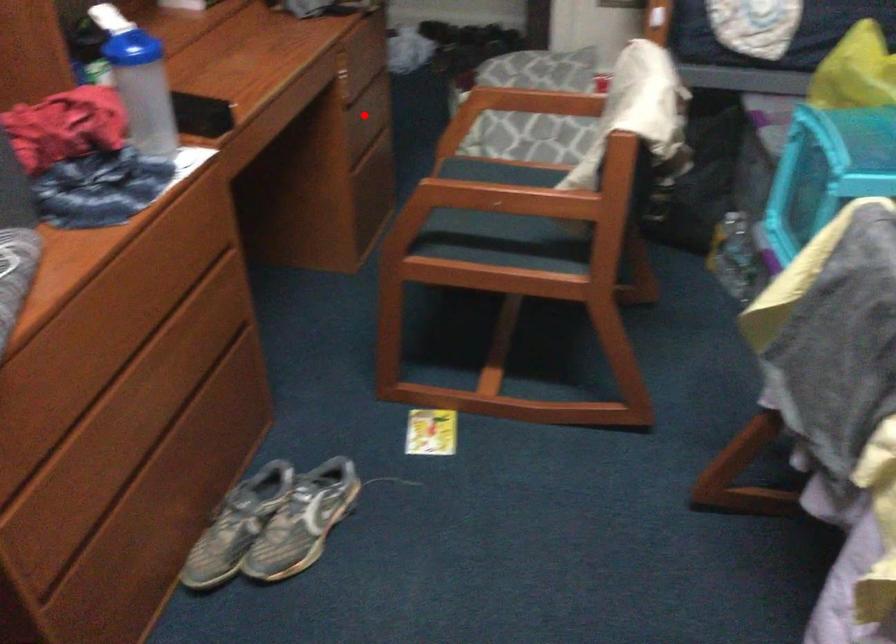
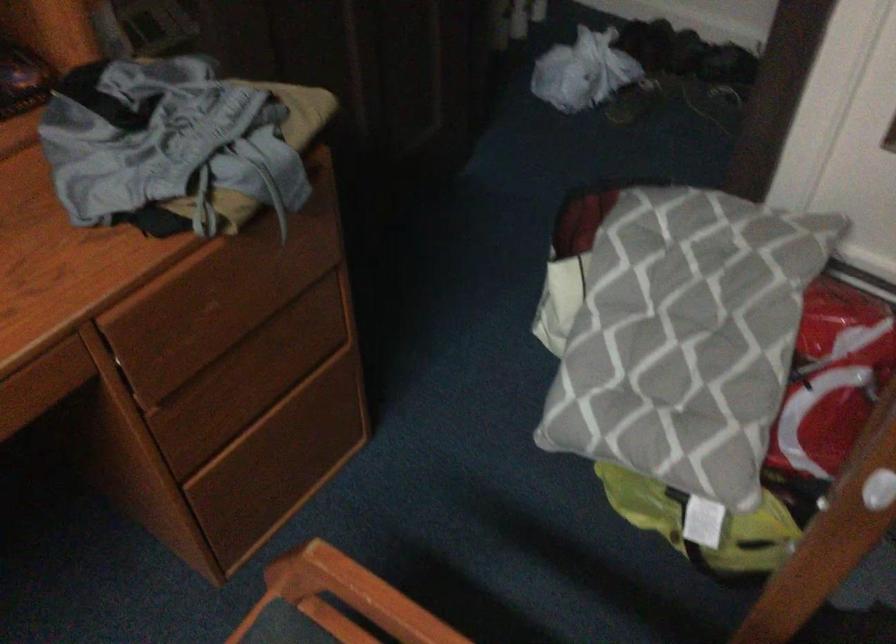
Locate, in the second image, the point that corresponds to the highlighted location in the first image.

(254, 377)